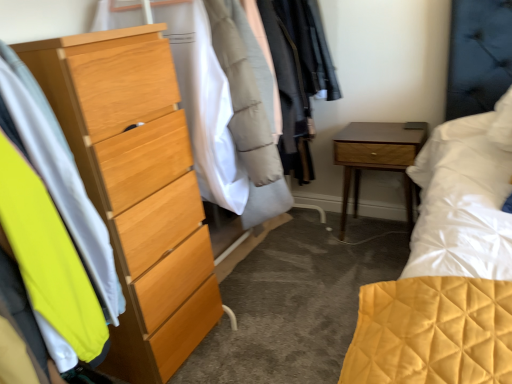
Question: Can you confirm if neon yellow fabric at left is smaller than light wood dresser at left?

Choices:
 (A) no
 (B) yes

Answer: (B)

Question: Is neon yellow fabric at left beside light wood dresser at left?

Choices:
 (A) no
 (B) yes

Answer: (A)

Question: Is neon yellow fabric at left at the right side of light wood dresser at left?

Choices:
 (A) yes
 (B) no

Answer: (B)

Question: From a real-world perspective, does neon yellow fabric at left stand above light wood dresser at left?

Choices:
 (A) yes
 (B) no

Answer: (A)

Question: Considering the relative sizes of neon yellow fabric at left and light wood dresser at left in the image provided, is neon yellow fabric at left thinner than light wood dresser at left?

Choices:
 (A) yes
 (B) no

Answer: (A)

Question: Does neon yellow fabric at left turn towards light wood dresser at left?

Choices:
 (A) no
 (B) yes

Answer: (A)

Question: From the image's perspective, is wooden nightstand at lower right located above light wood dresser at left?

Choices:
 (A) no
 (B) yes

Answer: (B)

Question: Can you confirm if wooden nightstand at lower right is positioned to the right of light wood dresser at left?

Choices:
 (A) yes
 (B) no

Answer: (A)

Question: Is wooden nightstand at lower right closer to camera compared to light wood dresser at left?

Choices:
 (A) yes
 (B) no

Answer: (B)

Question: Considering the relative positions of wooden nightstand at lower right and light wood dresser at left in the image provided, is wooden nightstand at lower right to the left of light wood dresser at left from the viewer's perspective?

Choices:
 (A) yes
 (B) no

Answer: (B)

Question: Is wooden nightstand at lower right facing away from light wood dresser at left?

Choices:
 (A) yes
 (B) no

Answer: (B)

Question: Is wooden nightstand at lower right far away from light wood dresser at left?

Choices:
 (A) yes
 (B) no

Answer: (A)

Question: Does wooden nightstand at lower right have a lesser width compared to neon yellow fabric at left?

Choices:
 (A) yes
 (B) no

Answer: (B)